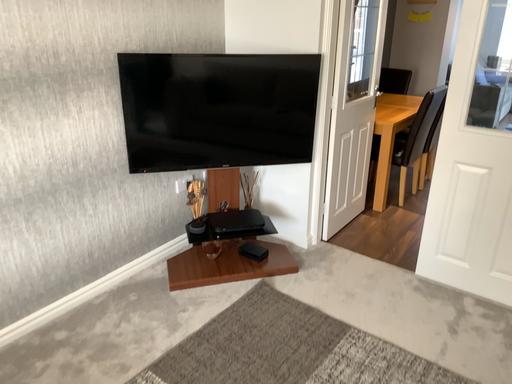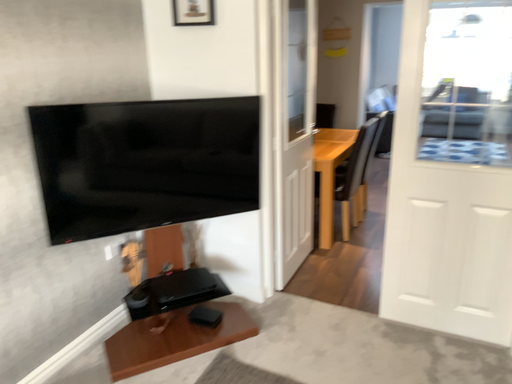
Question: Which way did the camera rotate in the video?

Choices:
 (A) rotated left
 (B) rotated right

Answer: (B)